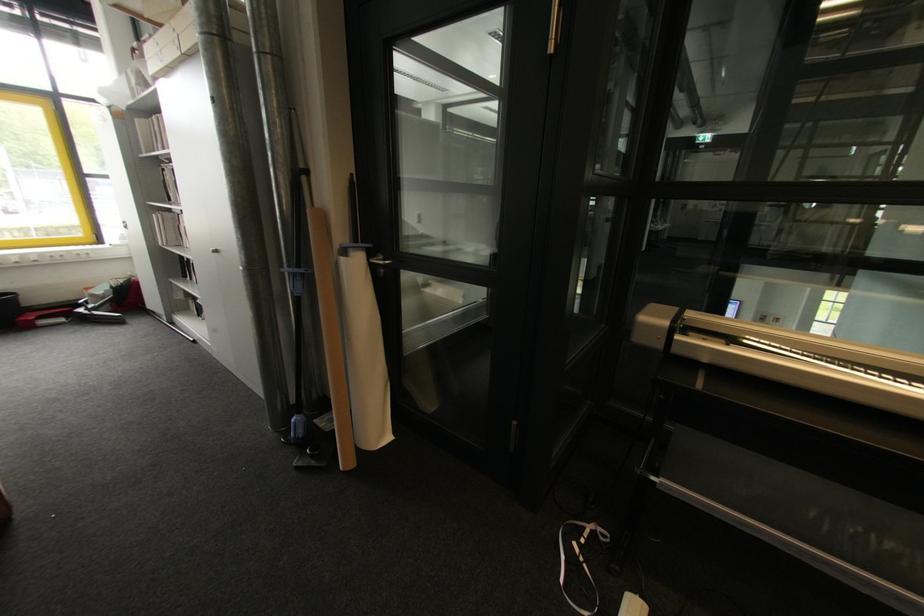
Find where to squeez the red stapler. Please return your answer as a coordinate pair (x, y).

(44, 315)